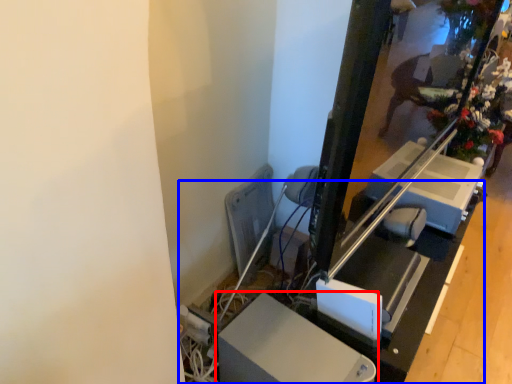
Question: Which of the following is the closest to the observer, furniture (highlighted by a red box) or table (highlighted by a blue box)?

Choices:
 (A) furniture
 (B) table

Answer: (A)